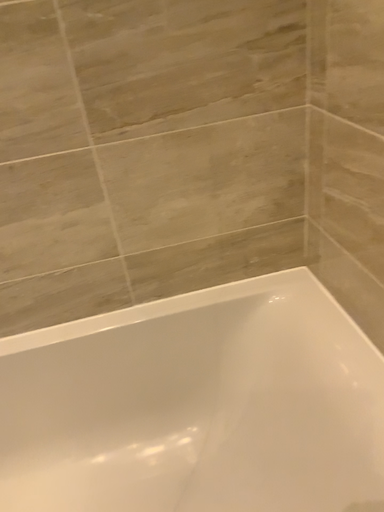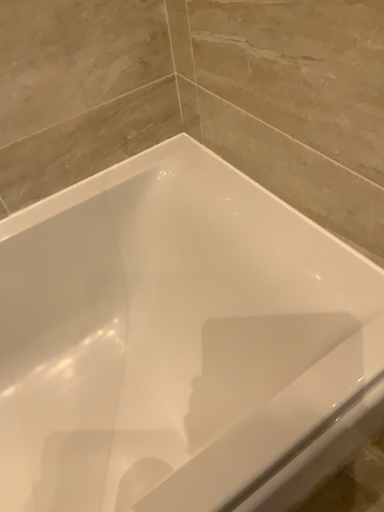
Question: How did the camera likely rotate when shooting the video?

Choices:
 (A) rotated right
 (B) rotated left

Answer: (A)